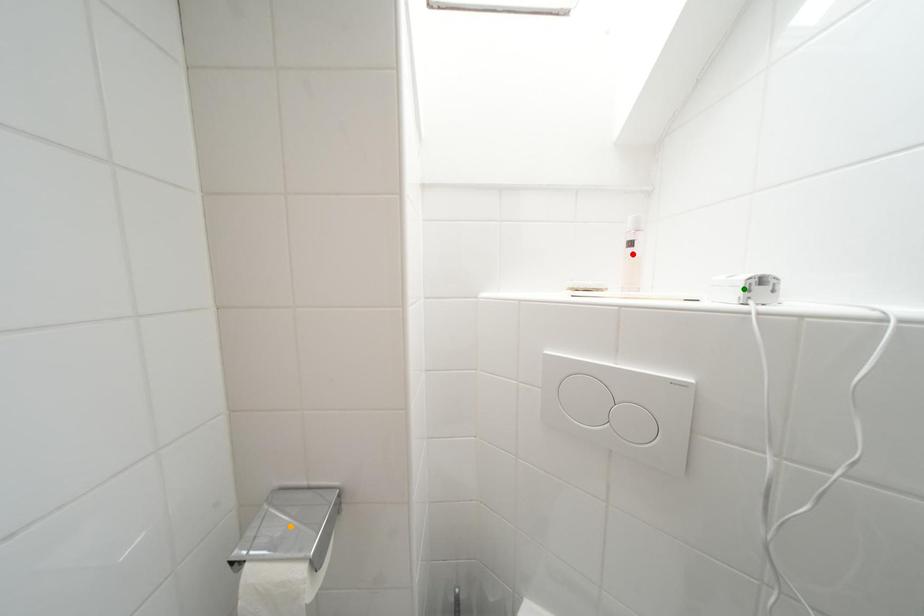
Order these from nearest to farthest:
A) green point
B) red point
C) orange point

1. green point
2. orange point
3. red point